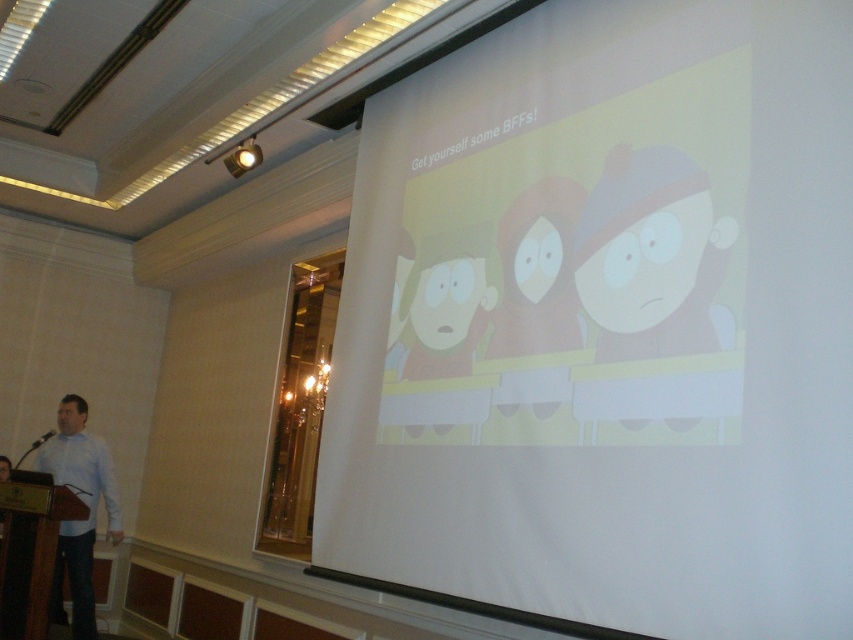
Is white shirt at left positioned behind white matte shirt at left?

Yes.

Is white shirt at left closer to the viewer compared to white matte shirt at left?

No, white shirt at left is behind white matte shirt at left.

Does point (55, 604) come closer to viewer compared to point (64, 531)?

No, (55, 604) is behind (64, 531).

You are a GUI agent. You are given a task and a screenshot of the screen. Output one action in this format:
    pyautogui.click(x=<x>, y=<y>)
    Task: Click on the white shirt at left
    
    Given the screenshot: What is the action you would take?
    pyautogui.click(x=84, y=502)